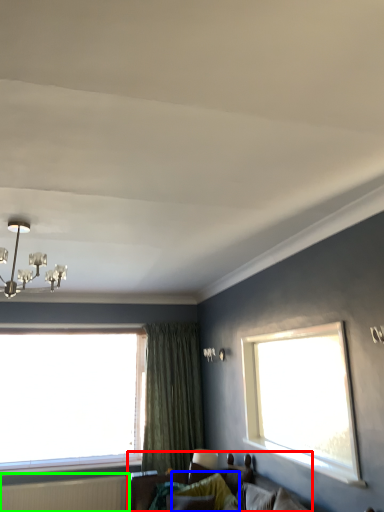
Question: Based on their relative distances, which object is nearer to studio couch (highlighted by a red box)? Choose from pillow (highlighted by a blue box) and radiator (highlighted by a green box).

Choices:
 (A) pillow
 (B) radiator

Answer: (A)